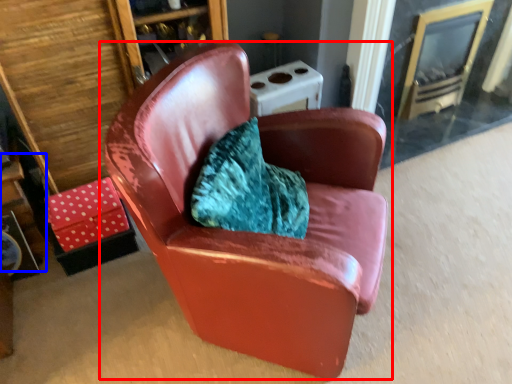
Question: Which of the following is the farthest to the observer, chair (highlighted by a red box) or table (highlighted by a blue box)?

Choices:
 (A) chair
 (B) table

Answer: (B)